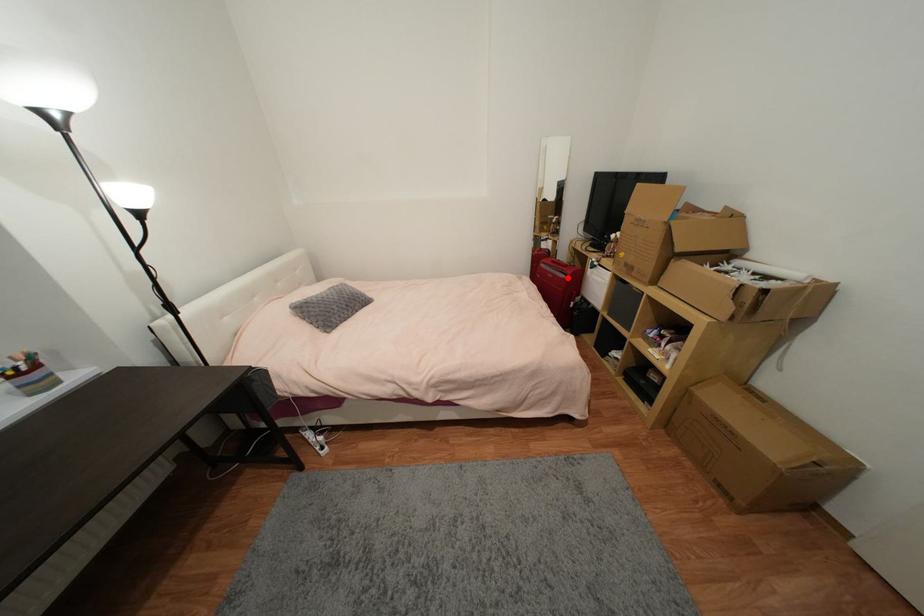
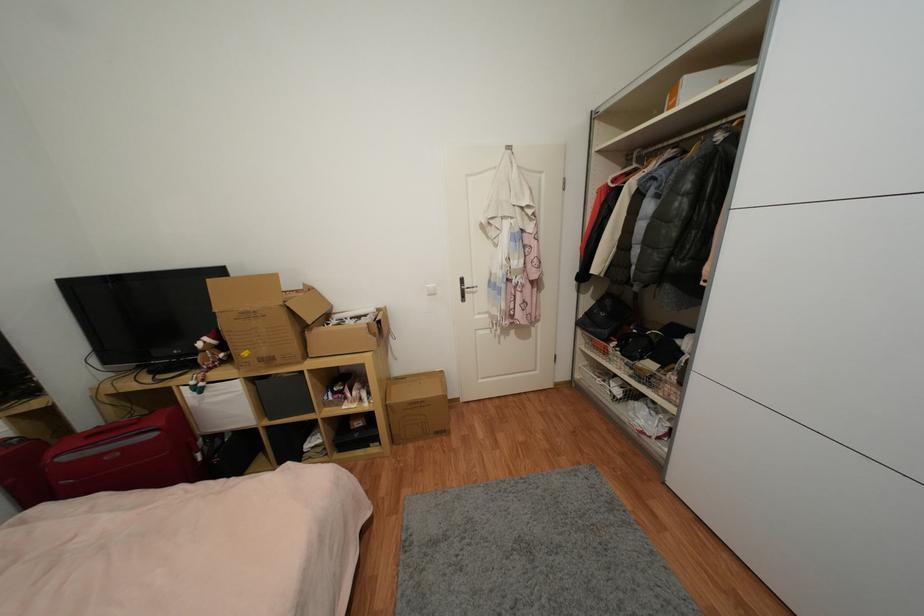
Find the pixel in the second image that matches the highlighted location in the first image.

(157, 436)